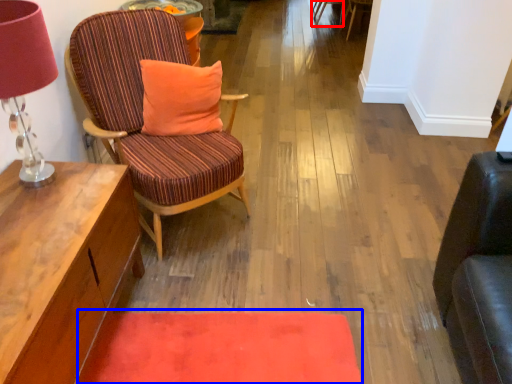
Question: Among these objects, which one is nearest to the camera, chair (highlighted by a red box) or mat (highlighted by a blue box)?

Choices:
 (A) chair
 (B) mat

Answer: (B)